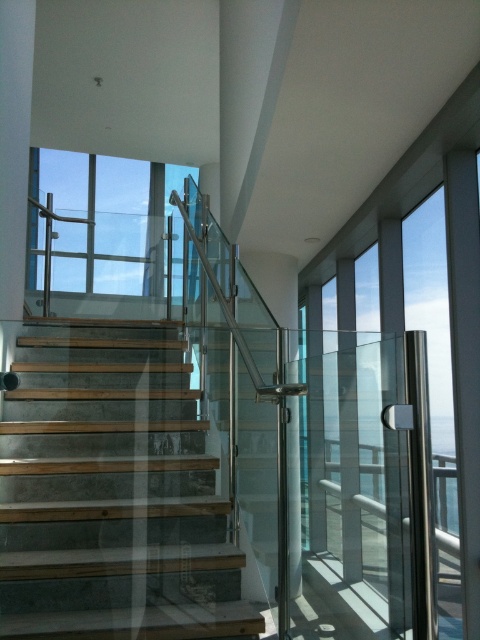
You are standing at the bottom of the staircase and want to look through the transparent glass window at upper center. Which direction should you move relative to the wooden steps at center?

To look through the transparent glass window at upper center, you should move to the left of the wooden steps at center, as the window is located to the left of the steps.